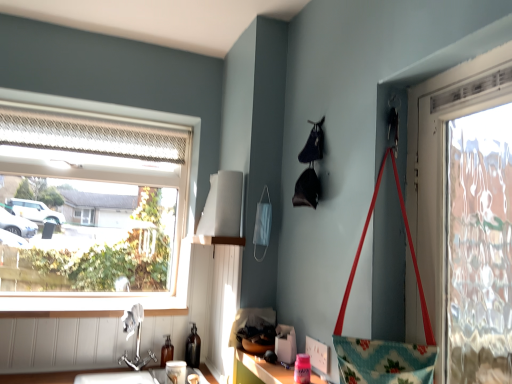
Question: Can you confirm if silver metallic faucet at lower left is wider than matte white cup at lower center?

Choices:
 (A) no
 (B) yes

Answer: (B)

Question: Is silver metallic faucet at lower left oriented towards matte white cup at lower center?

Choices:
 (A) no
 (B) yes

Answer: (A)

Question: Is the position of silver metallic faucet at lower left more distant than that of matte white cup at lower center?

Choices:
 (A) yes
 (B) no

Answer: (B)

Question: Can you confirm if silver metallic faucet at lower left is thinner than matte white cup at lower center?

Choices:
 (A) no
 (B) yes

Answer: (A)

Question: Considering the relative positions of silver metallic faucet at lower left and matte white cup at lower center in the image provided, is silver metallic faucet at lower left in front of matte white cup at lower center?

Choices:
 (A) no
 (B) yes

Answer: (B)

Question: In terms of height, does pink plastic container at lower center look taller or shorter compared to silver metallic faucet at lower left?

Choices:
 (A) tall
 (B) short

Answer: (B)

Question: From the image's perspective, is pink plastic container at lower center positioned above or below silver metallic faucet at lower left?

Choices:
 (A) below
 (B) above

Answer: (A)

Question: In the image, is pink plastic container at lower center positioned in front of or behind silver metallic faucet at lower left?

Choices:
 (A) front
 (B) behind

Answer: (A)

Question: Looking at the image, does pink plastic container at lower center seem bigger or smaller compared to silver metallic faucet at lower left?

Choices:
 (A) small
 (B) big

Answer: (A)

Question: Considering their positions, is pink plastic container at lower center located in front of or behind white plastic power outlet at lower center?

Choices:
 (A) front
 (B) behind

Answer: (A)

Question: In terms of width, does pink plastic container at lower center look wider or thinner when compared to white plastic power outlet at lower center?

Choices:
 (A) thin
 (B) wide

Answer: (B)

Question: From the image's perspective, is pink plastic container at lower center above or below white plastic power outlet at lower center?

Choices:
 (A) above
 (B) below

Answer: (B)

Question: Do you think pink plastic container at lower center is within white plastic power outlet at lower center, or outside of it?

Choices:
 (A) inside
 (B) outside

Answer: (B)

Question: Relative to translucent glass bottle at lower center, placed as the second bottle when sorted from right to left, is matte white cup at lower center in front or behind?

Choices:
 (A) front
 (B) behind

Answer: (A)

Question: From a real-world perspective, relative to translucent glass bottle at lower center, placed as the second bottle when sorted from right to left, is matte white cup at lower center vertically above or below?

Choices:
 (A) below
 (B) above

Answer: (A)